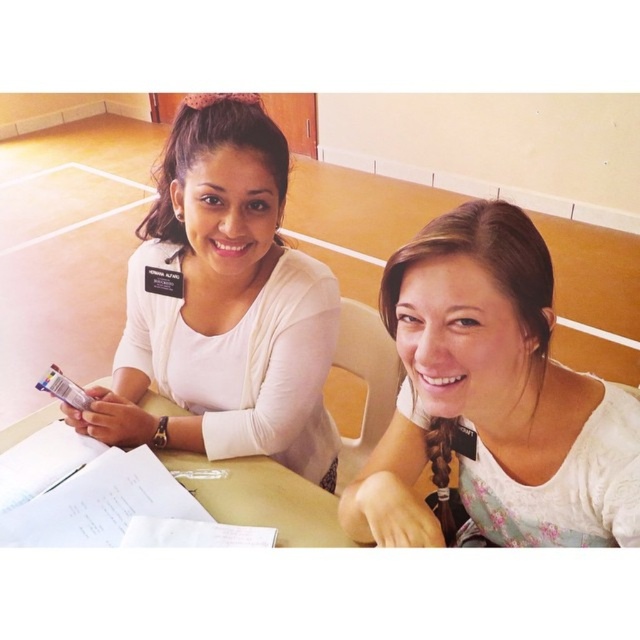
Is white floral blouse at center wider than white matte shirt at center?

No, white floral blouse at center is not wider than white matte shirt at center.

Can you confirm if white floral blouse at center is shorter than white matte shirt at center?

Yes.

Who is more distant from viewer, (625, 424) or (148, 248)?

Point (148, 248)

In order to click on white floral blouse at center in this screenshot , I will do `click(492, 401)`.

Can you confirm if white matte shirt at center is shorter than light brown wooden table at center?

No.

Who is positioned more to the right, white matte shirt at center or light brown wooden table at center?

Positioned to the right is white matte shirt at center.

Locate an element on the screen. The height and width of the screenshot is (640, 640). white matte shirt at center is located at coordinates (224, 305).

I want to click on white matte shirt at center, so click(224, 305).

Does white floral blouse at center have a lesser height compared to light brown wooden table at center?

No, white floral blouse at center is not shorter than light brown wooden table at center.

At what (x,y) coordinates should I click in order to perform the action: click on white floral blouse at center. Please return your answer as a coordinate pair (x, y). Looking at the image, I should click on (492, 401).